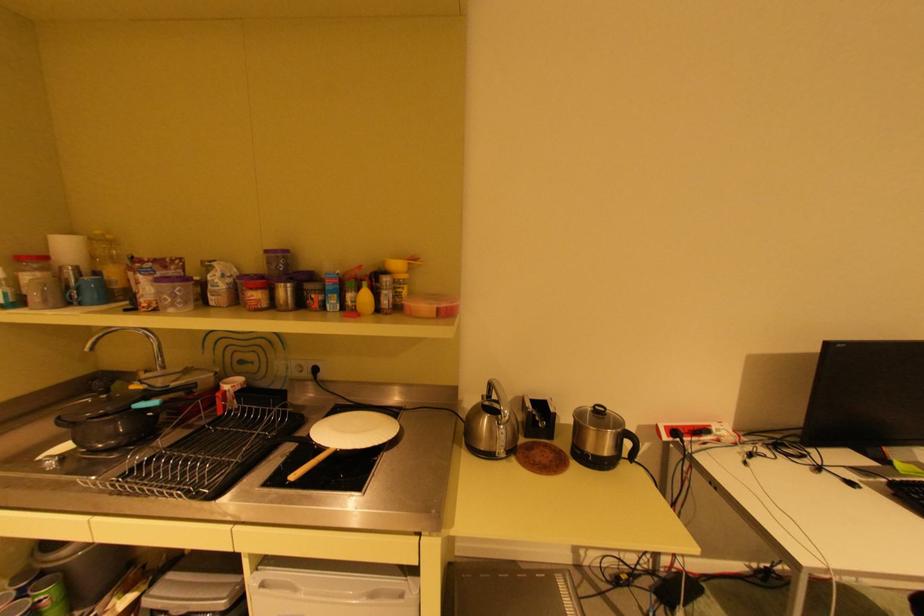
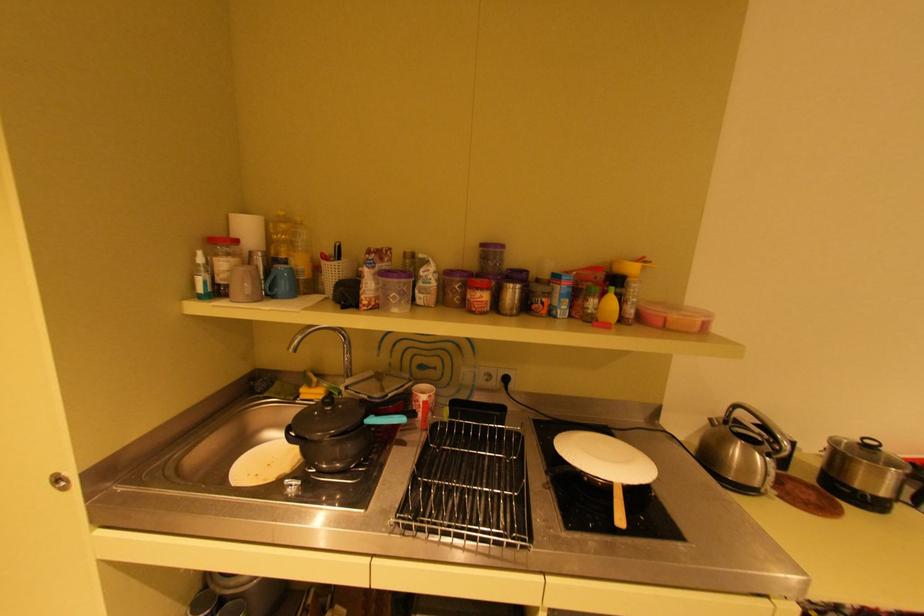
The point at (367, 309) is marked in the first image. Where is the corresponding point in the second image?

(611, 318)